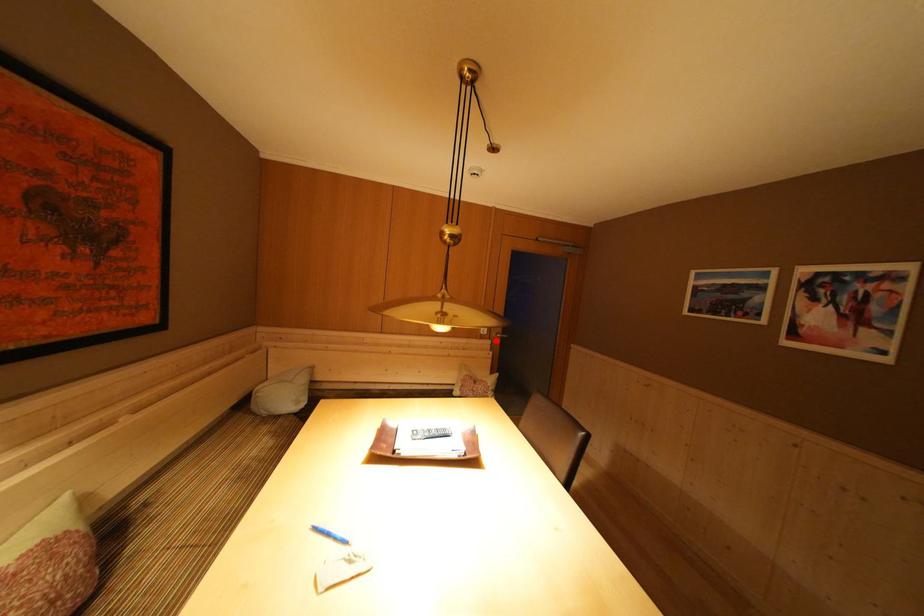
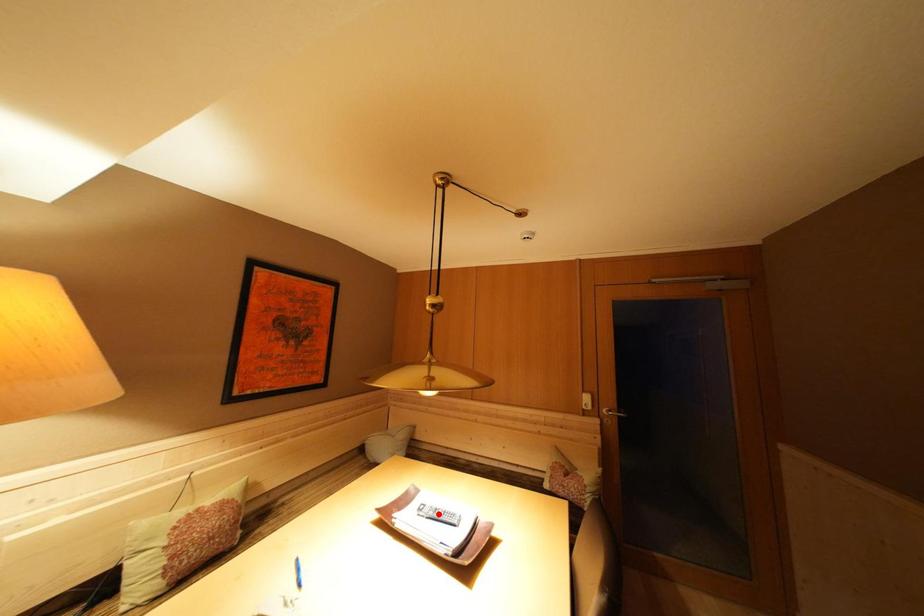
From the picture: I am providing you with two images of the same scene from different viewpoints. A red point is marked on the first image and another point is marked on the second image. Is the marked point in image1 the same physical position as the marked point in image2?

No